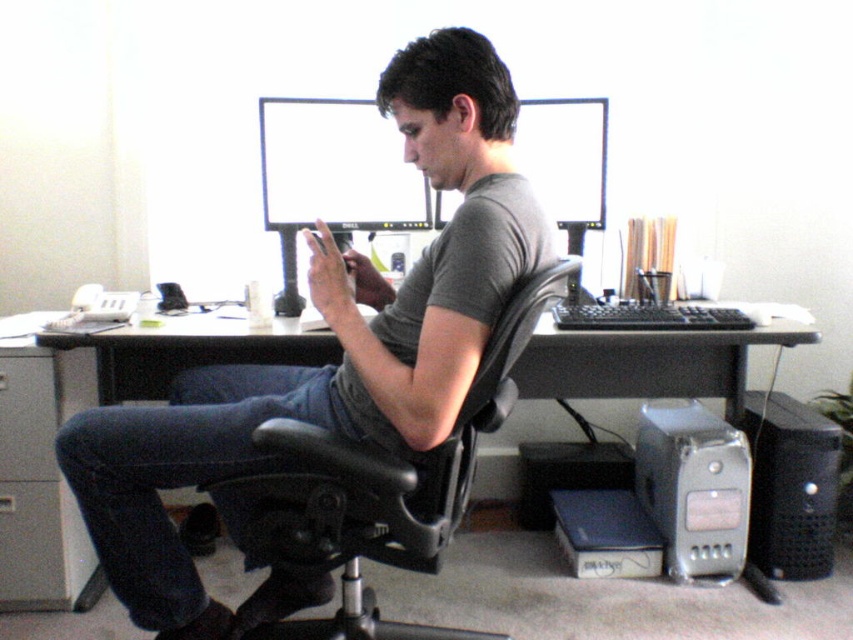
Question: Which of the following is the farthest from the observer?

Choices:
 (A) black leather office chair at center
 (B) matte black monitor at upper center
 (C) silver metallic computer at lower right
 (D) black plastic table at center

Answer: (B)

Question: Which point is closer to the camera taking this photo?

Choices:
 (A) (393, 147)
 (B) (538, 104)
 (C) (659, 410)
 (D) (334, 474)

Answer: (D)

Question: Which is farther from the matte black monitor at upper center?

Choices:
 (A) black leather office chair at center
 (B) gray matte shirt at center
 (C) silver metallic computer at lower right
 (D) black plastic table at center

Answer: (A)

Question: Is black plastic table at center bigger than matte black monitor at upper center?

Choices:
 (A) yes
 (B) no

Answer: (A)

Question: Is black plastic computer desk at center below matte black monitor at upper center?

Choices:
 (A) yes
 (B) no

Answer: (A)

Question: Does matte black monitor at center appear on the right side of matte black monitor at upper center?

Choices:
 (A) yes
 (B) no

Answer: (B)